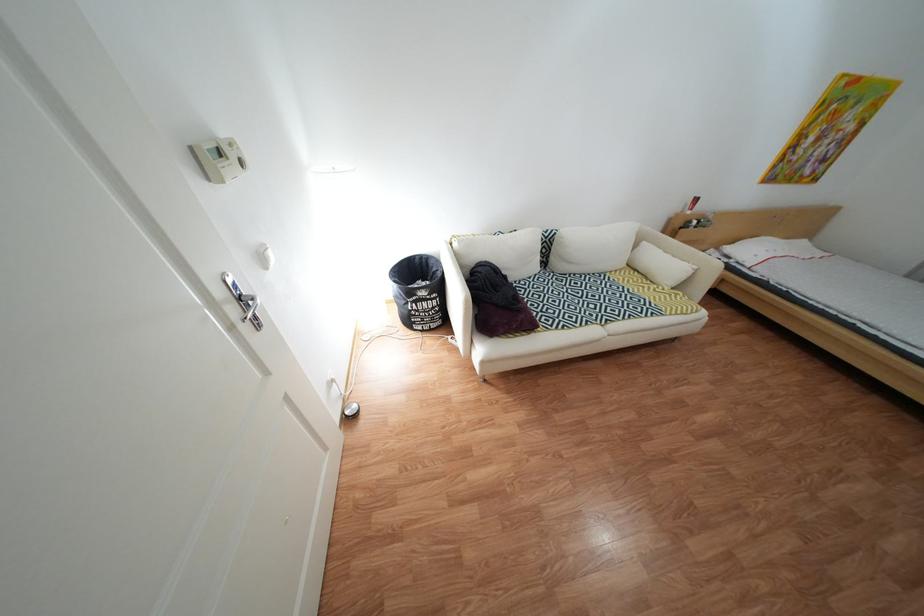
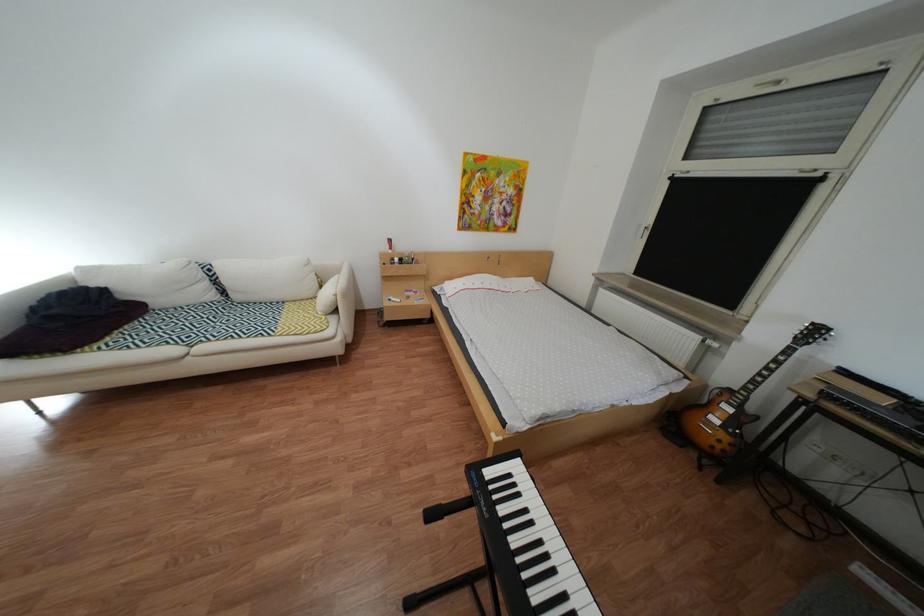
Find the pixel in the second image that matches point 527,277 in the first image.

(172, 304)